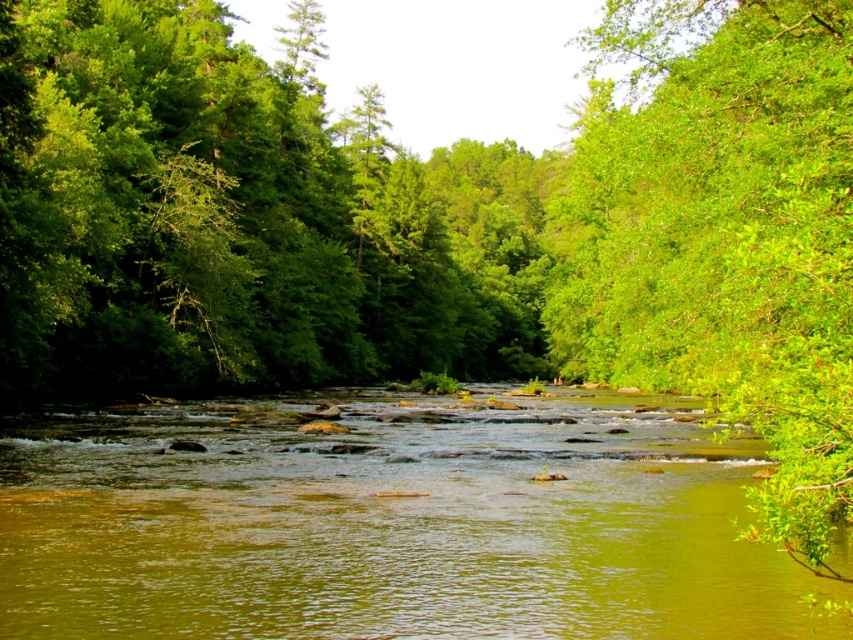
From the picture: You are a bird flying over the serene river scene. You want to land on a tree that is taller. Which tree should you choose between the green leafy tree at center and the green leafy tree at right?

The green leafy tree at center is taller than the green leafy tree at right, so you should choose the green leafy tree at center to land on.

You are a hiker standing at point (843, 218) and want to reach point (573, 621). Considering the river flows from the bottom to the top of the image, which direction should you walk to reach your destination?

Since point (573, 621) is behind point (843, 218), you should walk upstream against the river flow to reach your destination.

You are standing on the riverbank and want to cross the river using a small wooden plank. The plank is exactly as wide as the green leafy tree at right. Will the plank be wide enough to cover the green smooth water at center?

The green smooth water at center has a larger width than the green leafy tree at right. Since the plank is only as wide as the tree, it will not be wide enough to cover the green smooth water at center.